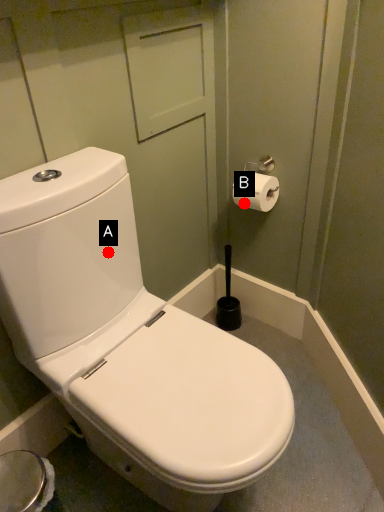
Question: Two points are circled on the image, labeled by A and B beside each circle. Which point is farther from the camera taking this photo?

Choices:
 (A) A is further
 (B) B is further

Answer: (B)